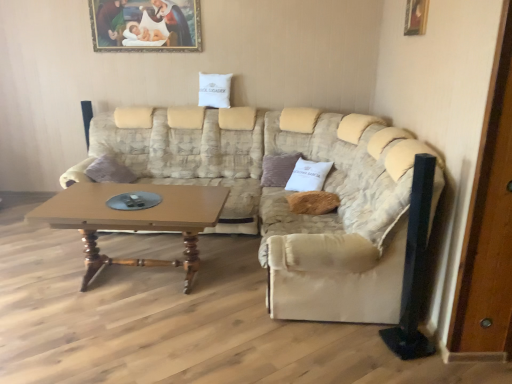
Image resolution: width=512 pixels, height=384 pixels. What are the coordinates of `vacant space to the right of wooden polished coffee table at center` in the screenshot? It's located at (245, 292).